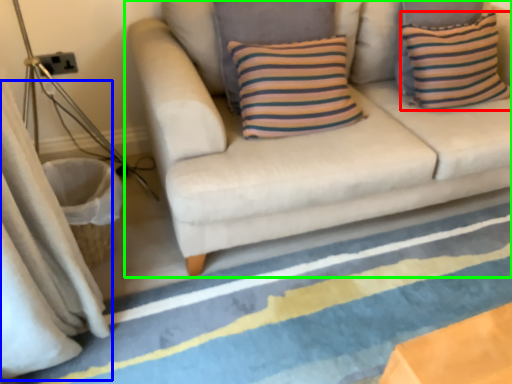
Question: Which object is positioned closest to pillow (highlighted by a red box)? Select from curtain (highlighted by a blue box) and studio couch (highlighted by a green box).

Choices:
 (A) curtain
 (B) studio couch

Answer: (B)